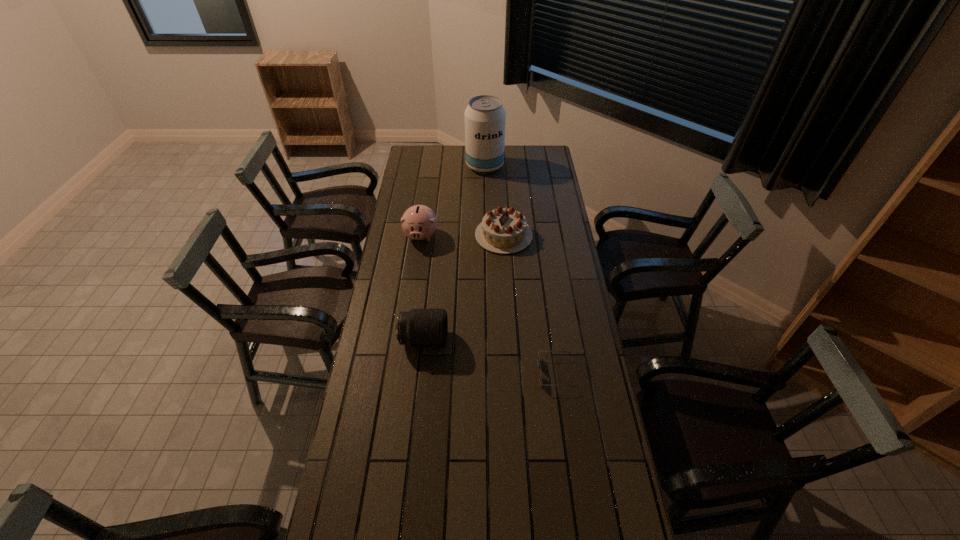
At what (x,y) coordinates should I click in order to perform the action: click on vacant space at the far right corner of the desktop. Please return your answer as a coordinate pair (x, y). The width and height of the screenshot is (960, 540). Looking at the image, I should click on (539, 145).

Locate an element on the screen. The width and height of the screenshot is (960, 540). free space between the fourth tallest object and the piggy bank is located at coordinates (463, 235).

The image size is (960, 540). In order to click on free space between the sunglasses and the piggy bank in this screenshot , I will do `click(489, 304)`.

I want to click on vacant region between the telephoto lens and the piggy bank, so click(422, 287).

Locate an element on the screen. This screenshot has height=540, width=960. empty space between the farthest object and the telephoto lens is located at coordinates (454, 253).

Locate an element on the screen. vacant point located between the farthest object and the piggy bank is located at coordinates (453, 200).

At what (x,y) coordinates should I click in order to perform the action: click on vacant region between the piggy bank and the nearest object. Please return your answer as a coordinate pair (x, y). The width and height of the screenshot is (960, 540). Looking at the image, I should click on (489, 304).

Find the location of a particular element. vacant region between the alcohol and the shortest object is located at coordinates point(520,269).

The image size is (960, 540). I want to click on vacant space in between the birthday cake and the telephoto lens, so click(464, 288).

Find the location of a particular element. This screenshot has height=540, width=960. free space between the piggy bank and the fourth farthest object is located at coordinates (422, 287).